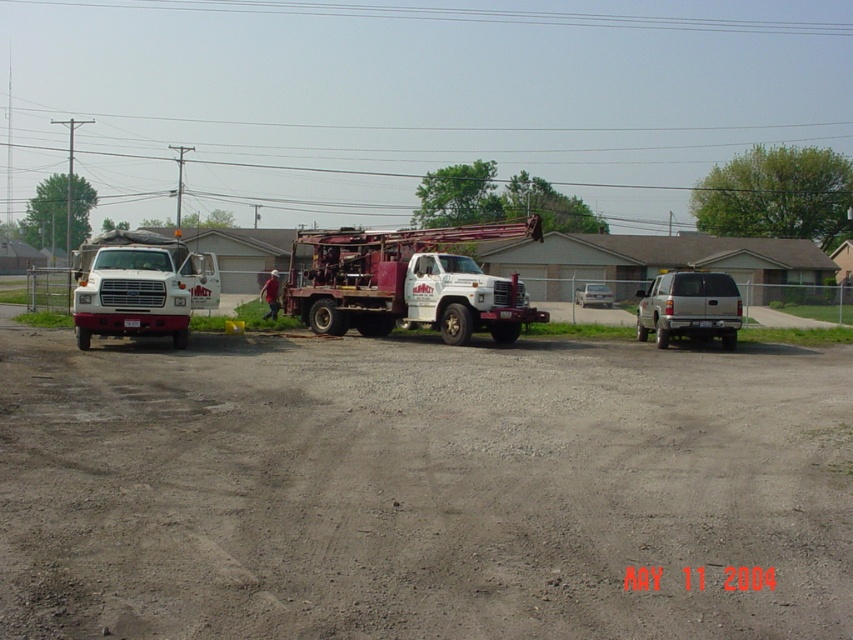
Question: Which of the following is the farthest from the observer?

Choices:
 (A) (592, 304)
 (B) (318, 12)

Answer: (B)

Question: Which object is closer to the camera taking this photo?

Choices:
 (A) white matte truck at left
 (B) gray gravel dirt track at center
 (C) brushed metal lift at center

Answer: (B)

Question: Is gray gravel dirt track at center positioned at the back of white painted metal drill truck at center?

Choices:
 (A) yes
 (B) no

Answer: (B)

Question: Can you confirm if white matte truck at left is thinner than brushed metal lift at center?

Choices:
 (A) yes
 (B) no

Answer: (B)

Question: Does gray gravel dirt track at center appear under white painted metal drill truck at center?

Choices:
 (A) no
 (B) yes

Answer: (B)

Question: Estimate the real-world distances between objects in this image. Which object is closer to the white painted metal drill truck at center?

Choices:
 (A) gray gravel dirt track at center
 (B) brushed metal lift at center
 (C) metallic wire at upper center

Answer: (A)